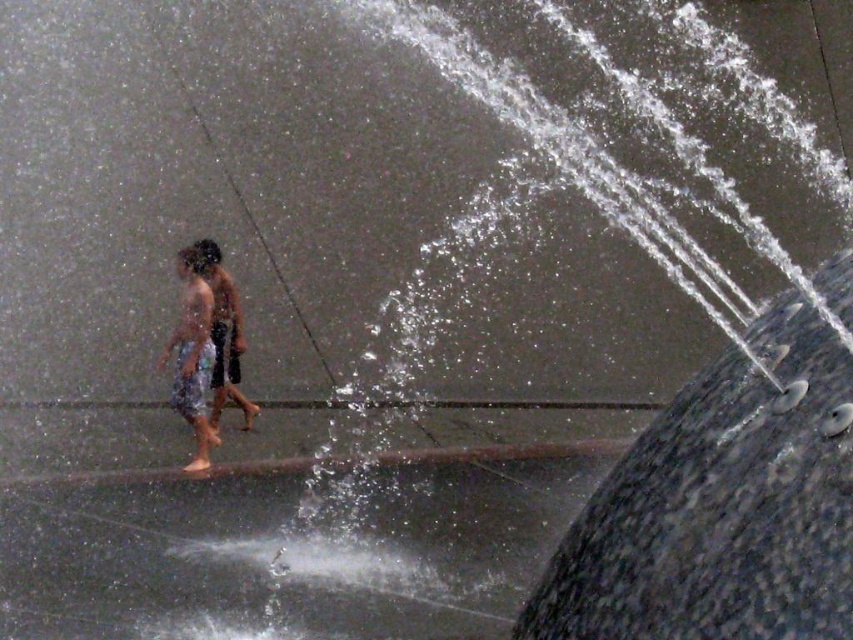
You are a photographer trying to capture the two people in the scene. Since you want to emphasize the height difference between the white cotton shorts at left and the shiny metallic shorts at center, which person should you position closer to the camera to make their shorts appear taller?

To emphasize the height difference, position the white cotton shorts at left closer to the camera since they already have a greater height compared to the shiny metallic shorts at center, making them appear even taller in the photo.

You are designing a new water feature and need to ensure that the two shorts, white cotton shorts at left and shiny metallic shorts at center, can fit side by side on a bench. Given their widths, will they both fit if the bench is 1.2 meters wide?

The white cotton shorts at left is wider than the shiny metallic shorts at center. Since the bench is 1.2 meters wide, both can fit side by side as long as their combined width does not exceed 1.2 meters. However, without knowing the exact widths, we cannot confirm for sure.